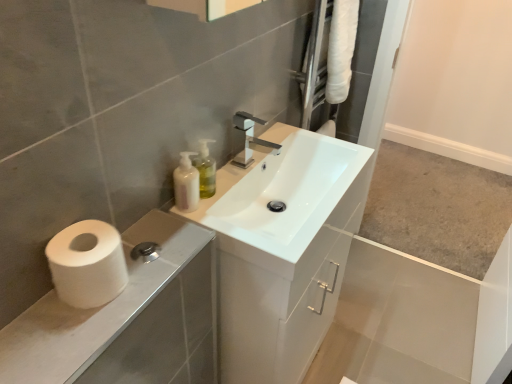
Where is `vacant space in front of white matte toilet paper at lower left`? vacant space in front of white matte toilet paper at lower left is located at coordinates (61, 338).